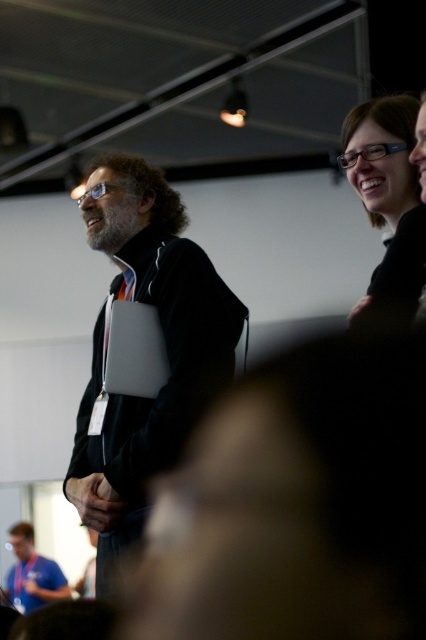
Question: Which point is closer to the camera taking this photo?

Choices:
 (A) (397, 148)
 (B) (97, 481)
 (C) (13, 580)

Answer: (A)

Question: Considering the relative positions of black matte jacket at center and matte black glasses at upper right in the image provided, where is black matte jacket at center located with respect to matte black glasses at upper right?

Choices:
 (A) right
 (B) left

Answer: (B)

Question: Does black matte jacket at center appear under matte black glasses at upper right?

Choices:
 (A) yes
 (B) no

Answer: (A)

Question: Which is nearer to the matte black glasses at upper right?

Choices:
 (A) black matte jacket at center
 (B) blue fabric shirt at lower left

Answer: (A)

Question: Which of the following is the closest to the observer?

Choices:
 (A) (160, 428)
 (B) (405, 141)
 (C) (13, 532)

Answer: (B)

Question: Is matte black glasses at upper right wider than blue fabric shirt at lower left?

Choices:
 (A) no
 (B) yes

Answer: (A)